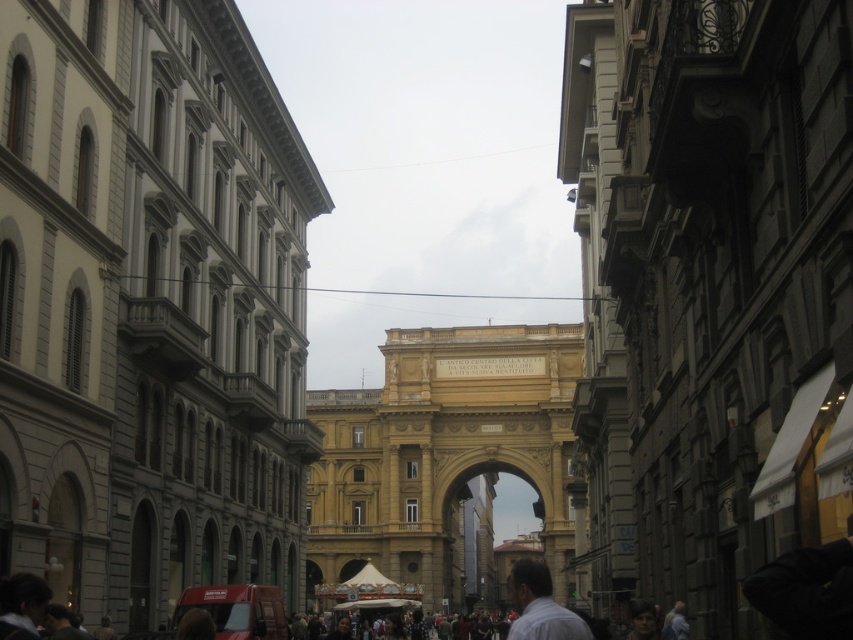
Question: Which of the following is the farthest from the observer?

Choices:
 (A) light brown hair at lower right
 (B) yellow stone archway at center

Answer: (B)

Question: Is yellow stone archway at center to the right of light brown hair at lower right from the viewer's perspective?

Choices:
 (A) no
 (B) yes

Answer: (B)

Question: Does dark brown hair at lower left appear over light brown hair at lower right?

Choices:
 (A) no
 (B) yes

Answer: (B)

Question: Which of these objects is positioned farthest from the light brown hair at lower right?

Choices:
 (A) yellow stone archway at center
 (B) light blue shirt at lower center
 (C) dark brown hair at lower left

Answer: (A)

Question: Does dark brown hair at lower left have a smaller size compared to light brown hair at lower right?

Choices:
 (A) no
 (B) yes

Answer: (B)

Question: Which is farther from the yellow stone archway at center?

Choices:
 (A) light brown hair at lower right
 (B) dark brown hair at lower left

Answer: (B)